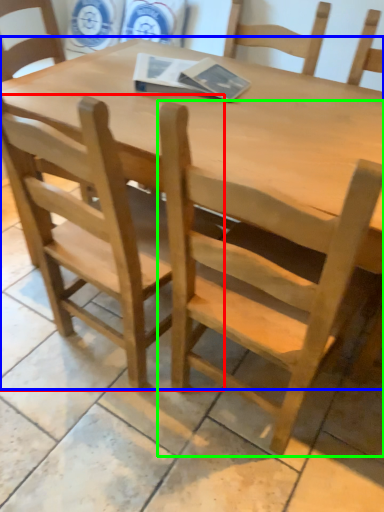
Question: Estimate the real-world distances between objects in this image. Which object is closer to chair (highlighted by a red box), table (highlighted by a blue box) or chair (highlighted by a green box)?

Choices:
 (A) table
 (B) chair

Answer: (B)